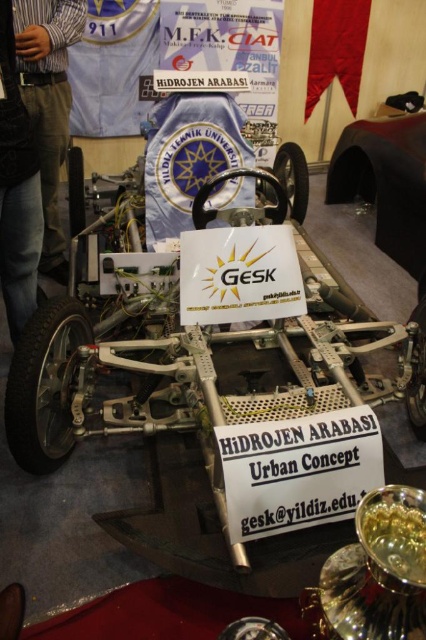
Is point (345, 193) closer to camera compared to point (72, 24)?

No.

Is the position of glossy black car at center more distant than that of brown denim pants at left?

Yes, it is behind brown denim pants at left.

Which is behind, point (356, 172) or point (51, 12)?

The point (356, 172) is behind.

The height and width of the screenshot is (640, 426). I want to click on glossy black car at center, so click(385, 182).

Between brown denim pants at left and black denim jeans at left, which one is positioned higher?

brown denim pants at left

Is the position of brown denim pants at left more distant than that of black denim jeans at left?

Yes.

I want to click on brown denim pants at left, so click(48, 102).

Identify the location of brown denim pants at left. (48, 102).

Locate an element on the screen. glossy black car at center is located at coordinates (385, 182).

Between glossy black car at center and black denim jeans at left, which one appears on the left side from the viewer's perspective?

Positioned to the left is black denim jeans at left.

This screenshot has height=640, width=426. What do you see at coordinates (385, 182) in the screenshot?
I see `glossy black car at center` at bounding box center [385, 182].

This screenshot has width=426, height=640. I want to click on glossy black car at center, so click(385, 182).